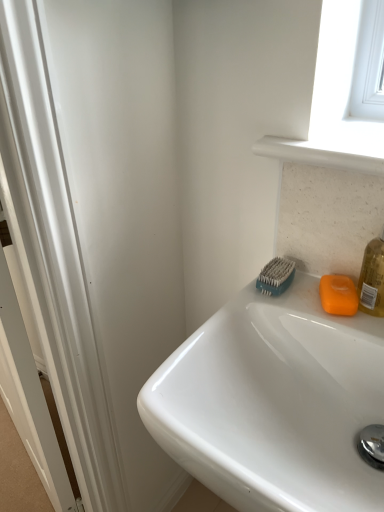
At what (x,y) coordinates should I click in order to perform the action: click on free space to the left of orange matte soap at right. Please return your answer as a coordinate pair (x, y). This screenshot has height=512, width=384. Looking at the image, I should click on (271, 309).